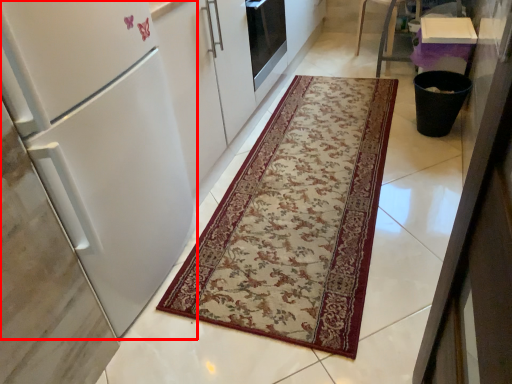
Question: From the image, what is the correct spatial relationship of refrigerator (annotated by the red box) in relation to mat?

Choices:
 (A) left
 (B) right

Answer: (A)